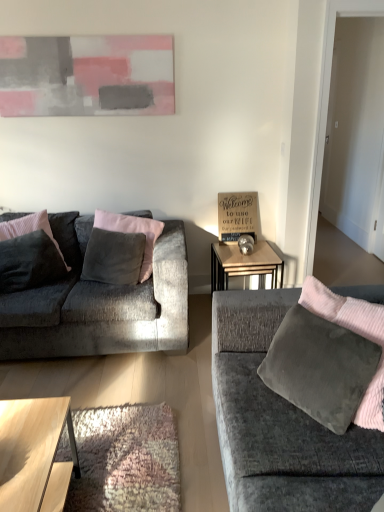
At what (x,y) coordinates should I click in order to perform the action: click on velvet dark gray pillow at left, the 1th pillow in the left-to-right sequence. Please return your answer as a coordinate pair (x, y). Looking at the image, I should click on (66, 236).

At what (x,y) coordinates should I click in order to perform the action: click on velvet gray couch at right, which ranks as the second studio couch in back-to-front order. Please return your answer as a coordinate pair (x, y). This screenshot has height=512, width=384. Looking at the image, I should click on (280, 423).

What do you see at coordinates (34, 454) in the screenshot? Image resolution: width=384 pixels, height=512 pixels. I see `light brown wooden coffee table at lower left` at bounding box center [34, 454].

Locate an element on the screen. The height and width of the screenshot is (512, 384). velvet gray pillow at center, the first pillow in the right-to-left sequence is located at coordinates (133, 233).

Image resolution: width=384 pixels, height=512 pixels. Describe the element at coordinates (100, 304) in the screenshot. I see `velvet grey couch at left, placed as the 1th studio couch when sorted from back to front` at that location.

The width and height of the screenshot is (384, 512). I want to click on abstract painting at upper center, so click(87, 75).

Is velvet dark gray pillow at left, which is counted as the second pillow, starting from the right, oriented towards abstract painting at upper center?

No.

From the image's perspective, which is above, velvet dark gray pillow at left, the 1th pillow in the left-to-right sequence, or abstract painting at upper center?

abstract painting at upper center, from the image's perspective.

Which object is positioned more to the right, velvet dark gray pillow at left, which is counted as the second pillow, starting from the right, or abstract painting at upper center?

Positioned to the right is abstract painting at upper center.

In terms of size, does velvet dark gray pillow at left, the 1th pillow in the left-to-right sequence, appear bigger or smaller than abstract painting at upper center?

In the image, velvet dark gray pillow at left, the 1th pillow in the left-to-right sequence, appears to be larger than abstract painting at upper center.

From a real-world perspective, is abstract painting at upper center on top of velvet dark gray pillow at left, the 1th pillow in the left-to-right sequence?

Correct, in the physical world, abstract painting at upper center is higher than velvet dark gray pillow at left, the 1th pillow in the left-to-right sequence.

Is point (56, 108) behind point (70, 219)?

No, it is in front of (70, 219).

From the image's perspective, between abstract painting at upper center and velvet dark gray pillow at left, the 1th pillow in the left-to-right sequence, who is located below?

velvet dark gray pillow at left, the 1th pillow in the left-to-right sequence, is shown below in the image.

Can you confirm if abstract painting at upper center is wider than velvet dark gray pillow at left, which is counted as the second pillow, starting from the right?

No, abstract painting at upper center is not wider than velvet dark gray pillow at left, which is counted as the second pillow, starting from the right.

Are metallic silver table at center and velvet dark gray pillow at left, which is counted as the second pillow, starting from the right, far apart?

Indeed, metallic silver table at center is not near velvet dark gray pillow at left, which is counted as the second pillow, starting from the right.

Is metallic silver table at center wider than velvet dark gray pillow at left, which is counted as the second pillow, starting from the right?

Correct, the width of metallic silver table at center exceeds that of velvet dark gray pillow at left, which is counted as the second pillow, starting from the right.

From the image's perspective, would you say metallic silver table at center is shown under velvet dark gray pillow at left, the 1th pillow in the left-to-right sequence?

Indeed, from the image's perspective, metallic silver table at center is shown beneath velvet dark gray pillow at left, the 1th pillow in the left-to-right sequence.

Is light brown wooden coffee table at lower left far from velvet dark gray pillow at left, which is counted as the second pillow, starting from the right?

Yes.

Between light brown wooden coffee table at lower left and velvet dark gray pillow at left, the 1th pillow in the left-to-right sequence, which one has smaller width?

velvet dark gray pillow at left, the 1th pillow in the left-to-right sequence.

Between point (18, 487) and point (62, 231), which one is positioned in front?

The point (18, 487) is closer.

Is light brown wooden coffee table at lower left shorter than velvet dark gray pillow at left, the 1th pillow in the left-to-right sequence?

Yes, light brown wooden coffee table at lower left is shorter than velvet dark gray pillow at left, the 1th pillow in the left-to-right sequence.

Can you confirm if velvet gray couch at right, which is the 2th studio couch in left-to-right order, is positioned to the left of abstract painting at upper center?

In fact, velvet gray couch at right, which is the 2th studio couch in left-to-right order, is to the right of abstract painting at upper center.

How many degrees apart are the facing directions of velvet gray couch at right, marked as the 1th studio couch in a right-to-left arrangement, and abstract painting at upper center?

The facing directions of velvet gray couch at right, marked as the 1th studio couch in a right-to-left arrangement, and abstract painting at upper center are 90 degrees apart.

Where is `picture frame above the velvet gray couch at right, which ranks as the second studio couch in back-to-front order (from the image's perspective)`? picture frame above the velvet gray couch at right, which ranks as the second studio couch in back-to-front order (from the image's perspective) is located at coordinates (87, 75).

Does point (236, 507) lie in front of point (99, 94)?

Yes, it is.

Find the location of `coffee table behind the velvet gray couch at right, which is the 2th studio couch in left-to-right order`. coffee table behind the velvet gray couch at right, which is the 2th studio couch in left-to-right order is located at coordinates (34, 454).

Which object is positioned more to the right, velvet gray couch at right, which ranks as the second studio couch in back-to-front order, or light brown wooden coffee table at lower left?

velvet gray couch at right, which ranks as the second studio couch in back-to-front order, is more to the right.

How much distance is there between velvet gray couch at right, marked as the 1th studio couch in a right-to-left arrangement, and light brown wooden coffee table at lower left?

29.89 inches.

Is velvet gray couch at right, acting as the first studio couch starting from the front, oriented away from light brown wooden coffee table at lower left?

No, velvet gray couch at right, acting as the first studio couch starting from the front, is not facing away from light brown wooden coffee table at lower left.

Based on the photo, is velvet gray couch at right, which ranks as the second studio couch in back-to-front order, facing towards metallic silver table at center?

No, velvet gray couch at right, which ranks as the second studio couch in back-to-front order, does not turn towards metallic silver table at center.

Based on the photo, choose the correct answer: Is velvet gray couch at right, which ranks as the second studio couch in back-to-front order, inside metallic silver table at center or outside it?

velvet gray couch at right, which ranks as the second studio couch in back-to-front order, exists outside the volume of metallic silver table at center.

Which is in front, point (292, 466) or point (213, 261)?

Positioned in front is point (292, 466).

Looking at the image, does velvet gray couch at right, acting as the first studio couch starting from the front, seem bigger or smaller compared to metallic silver table at center?

→ velvet gray couch at right, acting as the first studio couch starting from the front, is bigger than metallic silver table at center.

Where is `picture frame above the velvet dark gray pillow at left, the 1th pillow in the left-to-right sequence (from the image's perspective)`? Image resolution: width=384 pixels, height=512 pixels. picture frame above the velvet dark gray pillow at left, the 1th pillow in the left-to-right sequence (from the image's perspective) is located at coordinates (87, 75).

This screenshot has width=384, height=512. I want to click on picture frame that is above the velvet dark gray pillow at left, the 1th pillow in the left-to-right sequence (from a real-world perspective), so click(x=87, y=75).

Estimate the real-world distances between objects in this image. Which object is further from abstract painting at upper center, metallic silver table at center or velvet gray pillow at center, the first pillow in the right-to-left sequence?

The object further to abstract painting at upper center is metallic silver table at center.

Looking at the image, which one is located closer to velvet dark gray pillow at left, the 1th pillow in the left-to-right sequence, velvet gray couch at right, marked as the 1th studio couch in a right-to-left arrangement, or velvet grey couch at left, placed as the 1th studio couch when sorted from back to front?

Among the two, velvet grey couch at left, placed as the 1th studio couch when sorted from back to front, is located nearer to velvet dark gray pillow at left, the 1th pillow in the left-to-right sequence.

When comparing their distances from velvet gray couch at right, which ranks as the second studio couch in back-to-front order, does light brown wooden coffee table at lower left or metallic silver table at center seem closer?

light brown wooden coffee table at lower left is positioned closer to the anchor velvet gray couch at right, which ranks as the second studio couch in back-to-front order.

Based on their spatial positions, is velvet gray pillow at center, the first pillow in the right-to-left sequence, or abstract painting at upper center closer to light brown wooden coffee table at lower left?

The object closer to light brown wooden coffee table at lower left is velvet gray pillow at center, the first pillow in the right-to-left sequence.

Looking at the image, which one is located further to velvet gray couch at right, which is the 2th studio couch in left-to-right order, velvet dark gray pillow at left, which is counted as the second pillow, starting from the right, or velvet gray pillow at center, which is the 2th pillow from left to right?

The object further to velvet gray couch at right, which is the 2th studio couch in left-to-right order, is velvet dark gray pillow at left, which is counted as the second pillow, starting from the right.

From the image, which object appears to be nearer to velvet dark gray pillow at left, the 1th pillow in the left-to-right sequence, velvet gray couch at right, marked as the 1th studio couch in a right-to-left arrangement, or abstract painting at upper center?

abstract painting at upper center lies closer to velvet dark gray pillow at left, the 1th pillow in the left-to-right sequence, than the other object.

Based on their spatial positions, is metallic silver table at center or light brown wooden coffee table at lower left closer to velvet gray pillow at center, the first pillow in the right-to-left sequence?

metallic silver table at center is closer to velvet gray pillow at center, the first pillow in the right-to-left sequence.

Which object lies further to the anchor point velvet gray pillow at center, which is the 2th pillow from left to right, light brown wooden coffee table at lower left or metallic silver table at center?

light brown wooden coffee table at lower left.

Locate an element on the screen. Image resolution: width=384 pixels, height=512 pixels. studio couch between velvet dark gray pillow at left, which is counted as the second pillow, starting from the right, and velvet gray couch at right, which ranks as the second studio couch in back-to-front order is located at coordinates (100, 304).

You are a GUI agent. You are given a task and a screenshot of the screen. Output one action in this format:
    pyautogui.click(x=<x>, y=<y>)
    Task: Click on the coffee table between velvet gray couch at right, marked as the 1th studio couch in a right-to-left arrangement, and metallic silver table at center from front to back
    The height and width of the screenshot is (512, 384).
    Given the screenshot: What is the action you would take?
    pyautogui.click(x=34, y=454)

This screenshot has width=384, height=512. What are the coordinates of `studio couch between velvet gray couch at right, which ranks as the second studio couch in back-to-front order, and metallic silver table at center, along the z-axis` in the screenshot? It's located at tap(100, 304).

Find the location of a particular element. The width and height of the screenshot is (384, 512). studio couch between abstract painting at upper center and metallic silver table at center in the vertical direction is located at coordinates (100, 304).